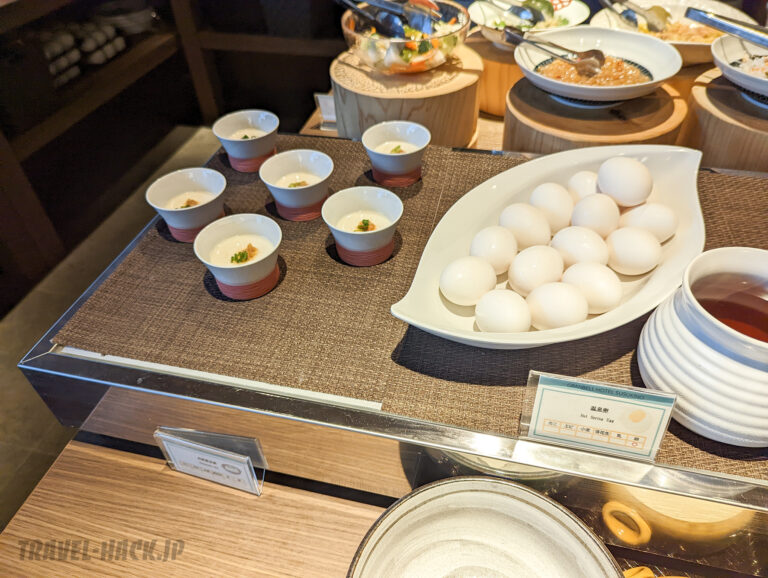
Find the location of a particular element. Image resolution: width=768 pixels, height=578 pixels. ceramic plate is located at coordinates (485, 536).